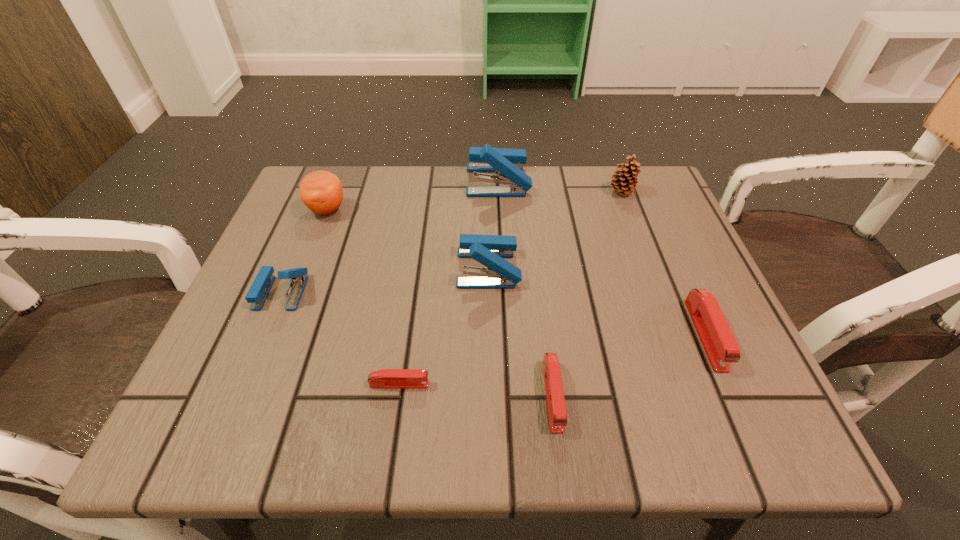
The image size is (960, 540). In the image, there is a desktop. In order to click on free space at the near edge in this screenshot , I will do `click(324, 403)`.

Identify the location of free space at the left edge of the desktop. Image resolution: width=960 pixels, height=540 pixels. (238, 374).

In the image, there is a desktop. In order to click on free space at the right edge in this screenshot , I will do `click(658, 347)`.

This screenshot has width=960, height=540. Find the location of `free space at the far left corner of the desktop`. free space at the far left corner of the desktop is located at coordinates (350, 197).

Find the location of `vacant space at the near left corner`. vacant space at the near left corner is located at coordinates (260, 393).

Identify the location of blank space at the far right corner of the desktop. (614, 216).

At what (x,y) coordinates should I click in order to perform the action: click on free area in between the leftmost red stapler and the second smallest blue stapler. Please return your answer as a coordinate pair (x, y). Looking at the image, I should click on (444, 326).

You are a GUI agent. You are given a task and a screenshot of the screen. Output one action in this format:
    pyautogui.click(x=<x>, y=<y>)
    Task: Click on the unoccupied area between the fifth shortest stapler and the leftmost blue stapler
    This screenshot has height=540, width=960.
    Given the screenshot: What is the action you would take?
    pyautogui.click(x=385, y=280)

Find the location of a particular element. free spot between the seventh tallest object and the pinecone is located at coordinates (587, 294).

In order to click on empty space that is in between the leftmost red stapler and the tallest stapler in this screenshot , I will do `click(448, 282)`.